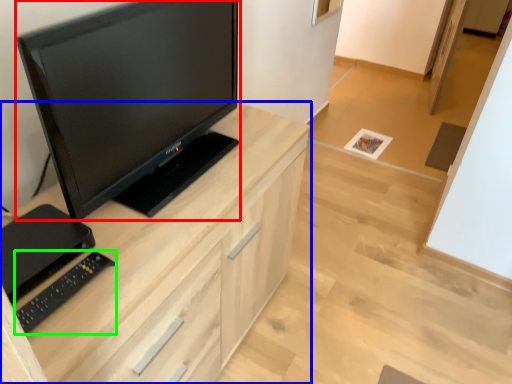
Question: Which object is the closest to the television (highlighted by a red box)? Choose among these: cabinetry (highlighted by a blue box) or equipment (highlighted by a green box).

Choices:
 (A) cabinetry
 (B) equipment

Answer: (A)